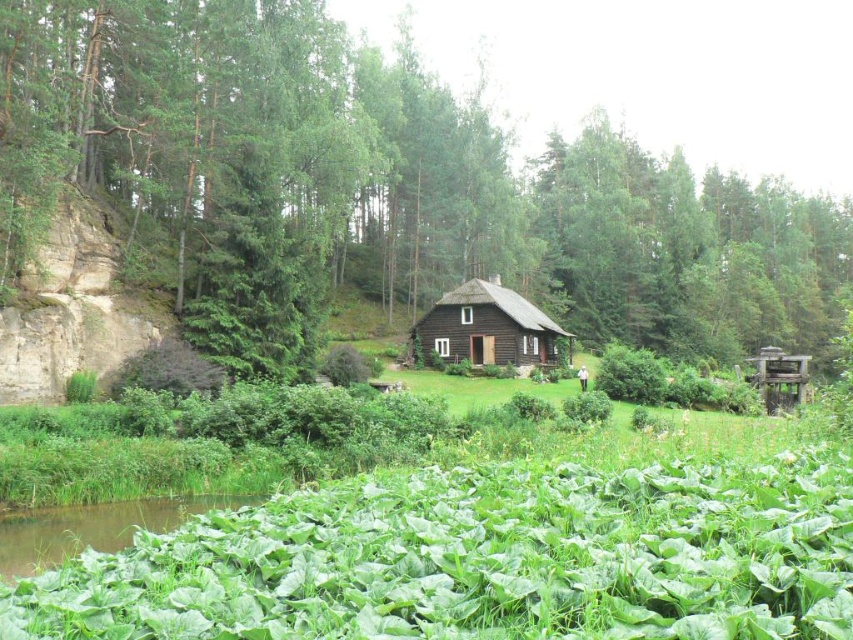
Who is more distant from viewer, (350, 246) or (538, 356)?

Point (350, 246)

Does point (79, 58) come in front of point (496, 326)?

Yes, it is in front of point (496, 326).

Identify the location of green leafy tree at center. (387, 182).